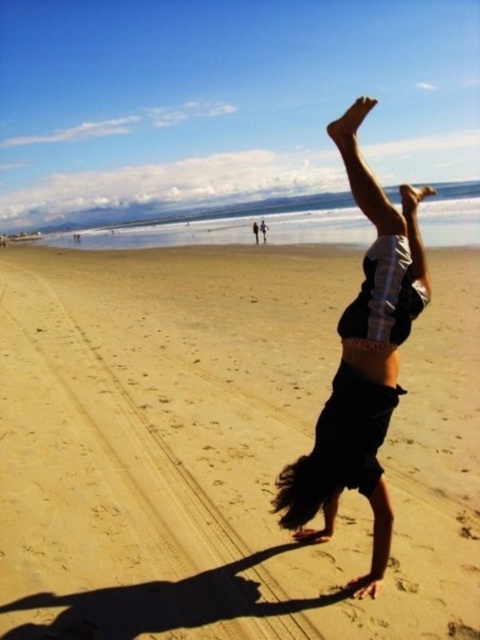
Question: Is sandy yellow at center above dark brown hair at center?

Choices:
 (A) yes
 (B) no

Answer: (B)

Question: Among these points, which one is farthest from the camera?

Choices:
 (A) (327, 634)
 (B) (325, 524)

Answer: (B)

Question: Does sandy yellow at center have a greater width compared to dark brown hair at center?

Choices:
 (A) no
 (B) yes

Answer: (B)

Question: Which object is farther from the camera taking this photo?

Choices:
 (A) sandy yellow at center
 (B) dark brown hair at center

Answer: (A)

Question: Among these points, which one is farthest from the camera?

Choices:
 (A) (402, 310)
 (B) (178, 448)

Answer: (B)

Question: Is sandy yellow at center bigger than dark brown hair at center?

Choices:
 (A) no
 (B) yes

Answer: (B)